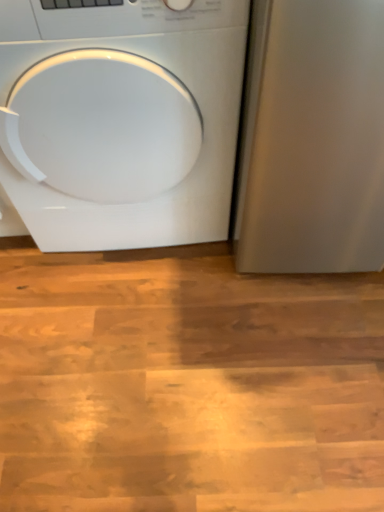
What do you see at coordinates (121, 121) in the screenshot?
I see `white glossy washing machine at left` at bounding box center [121, 121].

Locate an element on the screen. white glossy washing machine at left is located at coordinates (121, 121).

Identify the location of white glossy washing machine at left. (121, 121).